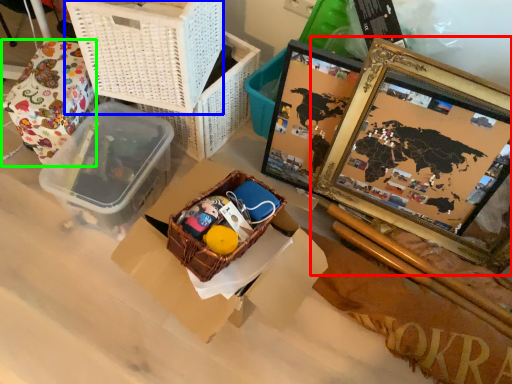
Question: Based on their relative distances, which object is nearer to picture frame (highlighted by a red box)? Choose from basket (highlighted by a blue box) and wrapping paper (highlighted by a green box).

Choices:
 (A) basket
 (B) wrapping paper

Answer: (A)